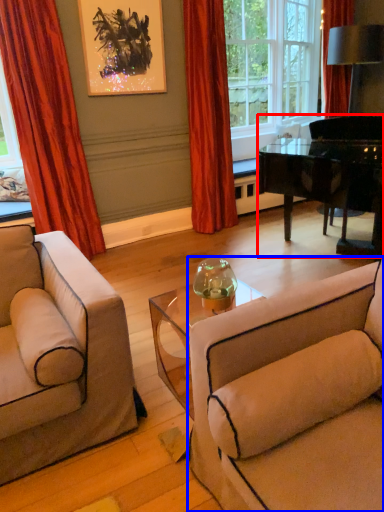
Question: Which object appears farthest to the camera in this image, piano (highlighted by a red box) or studio couch (highlighted by a blue box)?

Choices:
 (A) piano
 (B) studio couch

Answer: (A)